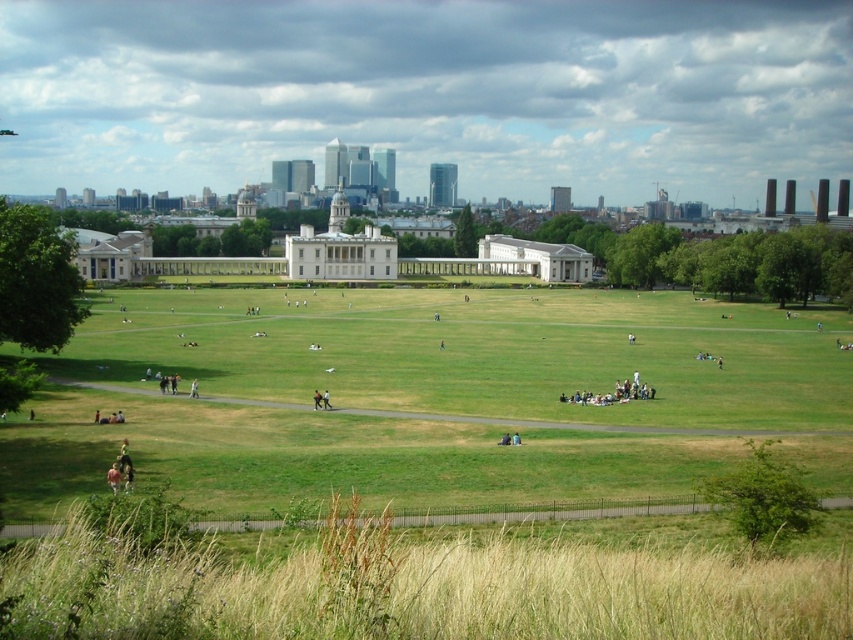
Question: Can you confirm if transparent glass skyscrapers at center is positioned below green grass at center?

Choices:
 (A) no
 (B) yes

Answer: (A)

Question: From the image, what is the correct spatial relationship of green grass at center in relation to light brown wooden bench at center?

Choices:
 (A) below
 (B) above

Answer: (B)

Question: Is transparent glass skyscrapers at center further to camera compared to green grass at center?

Choices:
 (A) yes
 (B) no

Answer: (A)

Question: Which point is farther to the camera?

Choices:
 (A) dark blue jeans at center
 (B) green grass at center
 (C) transparent glass skyscrapers at center
 (D) light brown wooden bench at center

Answer: (C)

Question: Which point is closer to the camera taking this photo?

Choices:
 (A) (650, 307)
 (B) (378, 131)

Answer: (A)

Question: Which point is farther to the camera?

Choices:
 (A) transparent glass skyscrapers at center
 (B) orange fabric person at center

Answer: (A)